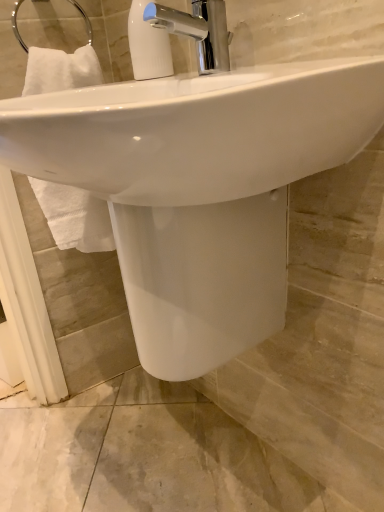
Question: Should I look upward or downward to see white plastic soap dispenser at upper center?

Choices:
 (A) down
 (B) up

Answer: (B)

Question: Is white glossy sink at center located outside chrome metallic faucet at upper center?

Choices:
 (A) yes
 (B) no

Answer: (A)

Question: Are white glossy sink at center and chrome metallic faucet at upper center beside each other?

Choices:
 (A) no
 (B) yes

Answer: (A)

Question: Does white glossy sink at center have a lesser height compared to chrome metallic faucet at upper center?

Choices:
 (A) no
 (B) yes

Answer: (A)

Question: Does white glossy sink at center appear on the left side of chrome metallic faucet at upper center?

Choices:
 (A) no
 (B) yes

Answer: (B)

Question: From a real-world perspective, is white glossy sink at center positioned over chrome metallic faucet at upper center based on gravity?

Choices:
 (A) yes
 (B) no

Answer: (B)

Question: Can you confirm if white glossy sink at center is wider than chrome metallic faucet at upper center?

Choices:
 (A) yes
 (B) no

Answer: (A)

Question: Does chrome metallic faucet at upper center touch white glossy sink at center?

Choices:
 (A) yes
 (B) no

Answer: (B)

Question: Is chrome metallic faucet at upper center bigger than white glossy sink at center?

Choices:
 (A) yes
 (B) no

Answer: (B)

Question: Is chrome metallic faucet at upper center taller than white glossy sink at center?

Choices:
 (A) yes
 (B) no

Answer: (B)

Question: Can you confirm if chrome metallic faucet at upper center is smaller than white glossy sink at center?

Choices:
 (A) no
 (B) yes

Answer: (B)

Question: Is chrome metallic faucet at upper center not within white glossy sink at center?

Choices:
 (A) yes
 (B) no

Answer: (A)

Question: Could white glossy sink at center be considered to be inside chrome metallic faucet at upper center?

Choices:
 (A) no
 (B) yes

Answer: (A)

Question: Does white plastic soap dispenser at upper center have a lesser width compared to white glossy sink at center?

Choices:
 (A) yes
 (B) no

Answer: (A)